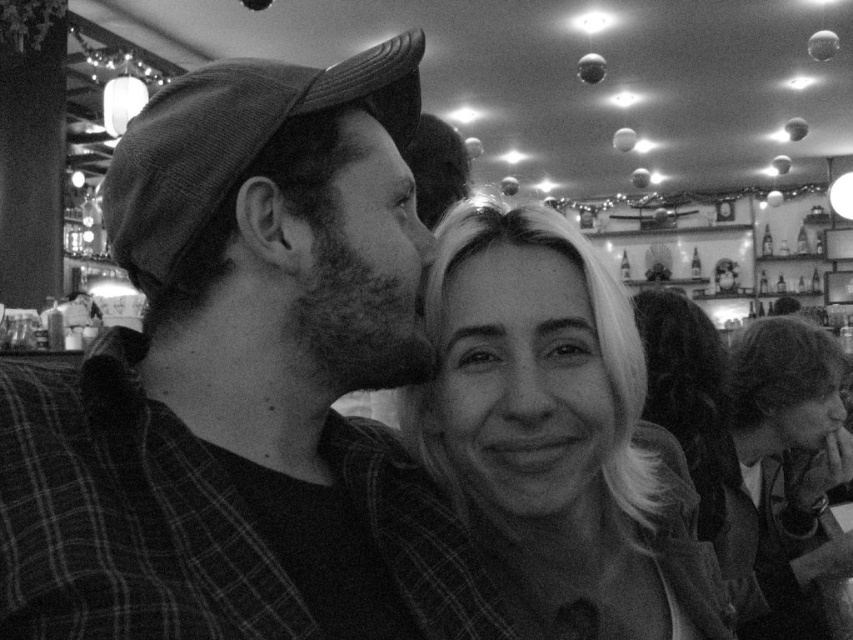
Question: Can you confirm if smooth blonde hair at center is thinner than smooth skin at center?

Choices:
 (A) yes
 (B) no

Answer: (B)

Question: Which object is positioned closest to the plaid fabric shirt at left?

Choices:
 (A) smooth blonde hair at center
 (B) smooth blonde hair at lower right
 (C) smooth skin at center

Answer: (A)

Question: Considering the relative positions of smooth blonde hair at center and smooth blonde hair at lower right in the image provided, where is smooth blonde hair at center located with respect to smooth blonde hair at lower right?

Choices:
 (A) above
 (B) below

Answer: (A)

Question: Which object is closer to the camera taking this photo?

Choices:
 (A) plaid fabric shirt at left
 (B) smooth skin at center
 (C) smooth blonde hair at lower right

Answer: (A)

Question: Is plaid fabric shirt at left positioned in front of smooth blonde hair at lower right?

Choices:
 (A) no
 (B) yes

Answer: (B)

Question: Which point is farther to the camera?

Choices:
 (A) (537, 502)
 (B) (538, 241)
 (C) (227, 563)

Answer: (B)